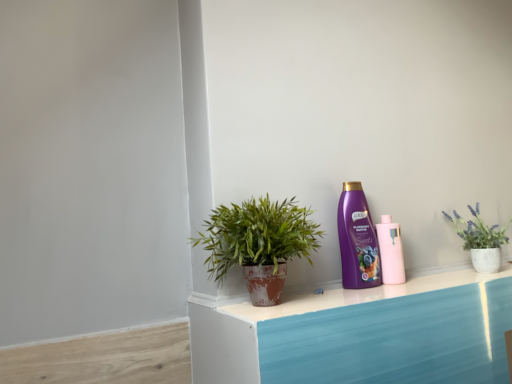
Question: Considering the relative sizes of pink matte bottle at center-right, which appears as the 1th bottle when viewed from the right, and terracotta pot plant at center in the image provided, is pink matte bottle at center-right, which appears as the 1th bottle when viewed from the right, shorter than terracotta pot plant at center?

Choices:
 (A) no
 (B) yes

Answer: (B)

Question: Does pink matte bottle at center-right, which appears as the 1th bottle when viewed from the right, have a smaller size compared to terracotta pot plant at center?

Choices:
 (A) yes
 (B) no

Answer: (A)

Question: Can you confirm if pink matte bottle at center-right, which appears as the 1th bottle when viewed from the right, is bigger than terracotta pot plant at center?

Choices:
 (A) yes
 (B) no

Answer: (B)

Question: Does pink matte bottle at center-right, which appears as the second bottle when viewed from the left, have a lesser width compared to terracotta pot plant at center?

Choices:
 (A) no
 (B) yes

Answer: (B)

Question: Does pink matte bottle at center-right, which appears as the 1th bottle when viewed from the right, turn towards terracotta pot plant at center?

Choices:
 (A) yes
 (B) no

Answer: (B)

Question: Is pink matte bottle at center-right, which appears as the 1th bottle when viewed from the right, positioned in front of terracotta pot plant at center?

Choices:
 (A) no
 (B) yes

Answer: (A)

Question: Is purple plastic bottle at center-right, arranged as the 2th bottle when viewed from the right, not inside terracotta pot plant at center?

Choices:
 (A) no
 (B) yes

Answer: (B)

Question: Is there a large distance between purple plastic bottle at center-right, arranged as the 1th bottle when viewed from the left, and terracotta pot plant at center?

Choices:
 (A) no
 (B) yes

Answer: (A)

Question: Is purple plastic bottle at center-right, arranged as the 1th bottle when viewed from the left, thinner than terracotta pot plant at center?

Choices:
 (A) yes
 (B) no

Answer: (A)

Question: Is the depth of purple plastic bottle at center-right, arranged as the 2th bottle when viewed from the right, greater than that of terracotta pot plant at center?

Choices:
 (A) no
 (B) yes

Answer: (B)

Question: Is purple plastic bottle at center-right, arranged as the 2th bottle when viewed from the right, wider than terracotta pot plant at center?

Choices:
 (A) yes
 (B) no

Answer: (B)

Question: Could you tell me if purple plastic bottle at center-right, arranged as the 2th bottle when viewed from the right, is facing terracotta pot plant at center?

Choices:
 (A) no
 (B) yes

Answer: (A)

Question: From the image's perspective, is terracotta pot plant at center located above purple plastic bottle at center-right, arranged as the 2th bottle when viewed from the right?

Choices:
 (A) no
 (B) yes

Answer: (B)